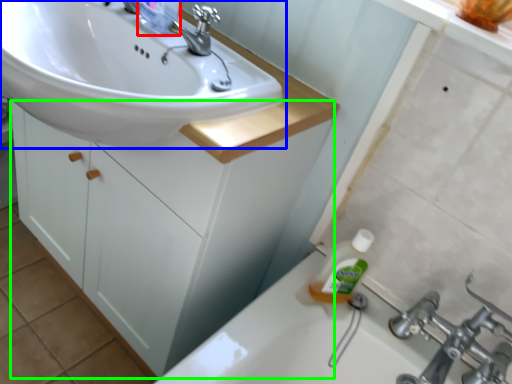
Question: Considering the real-world distances, which object is farthest from toiletry (highlighted by a red box)? sink (highlighted by a blue box) or bathroom cabinet (highlighted by a green box)?

Choices:
 (A) sink
 (B) bathroom cabinet

Answer: (B)